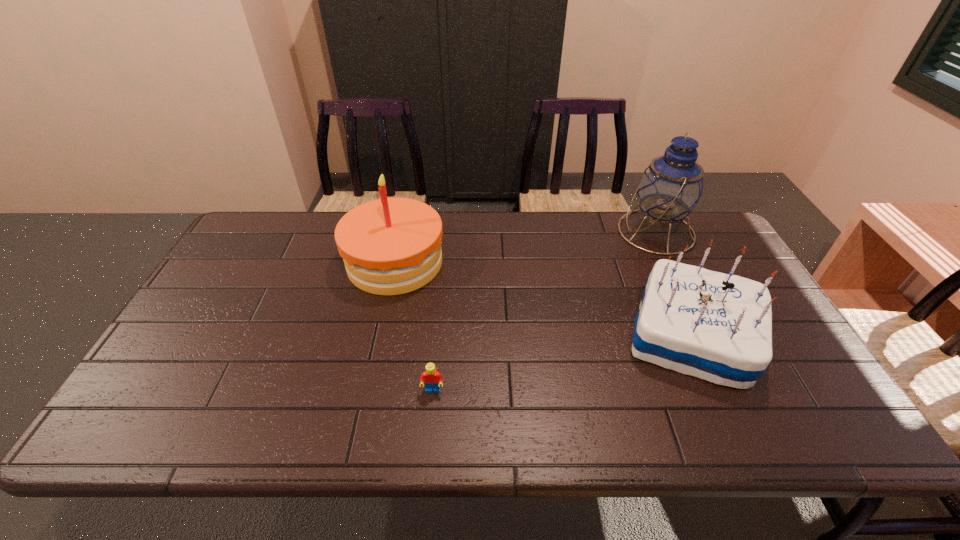
At what (x,y) coordinates should I click in order to perform the action: click on free space that satisfies the following two spatial constraints: 1. on the front side of the left birthday cake; 2. on the right side of the right birthday cake. Please return your answer as a coordinate pair (x, y). Image resolution: width=960 pixels, height=540 pixels. Looking at the image, I should click on (379, 336).

Find the location of `vacant space that satisfies the following two spatial constraints: 1. on the front-facing side of the lantern; 2. on the face of the shortest object`. vacant space that satisfies the following two spatial constraints: 1. on the front-facing side of the lantern; 2. on the face of the shortest object is located at coordinates (732, 390).